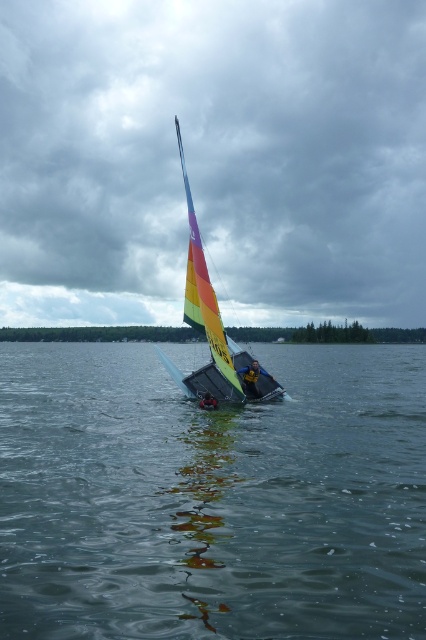
Based on the photo, does clear water at sailboat center appear on the right side of rainbow sailboat at center?

Yes, clear water at sailboat center is to the right of rainbow sailboat at center.

Is clear water at sailboat center above rainbow sailboat at center?

Incorrect, clear water at sailboat center is not positioned above rainbow sailboat at center.

Between point (403, 371) and point (195, 328), which one is positioned behind?

Positioned behind is point (403, 371).

At what (x,y) coordinates should I click in order to perform the action: click on clear water at sailboat center. Please return your answer as a coordinate pair (x, y). Looking at the image, I should click on (210, 497).